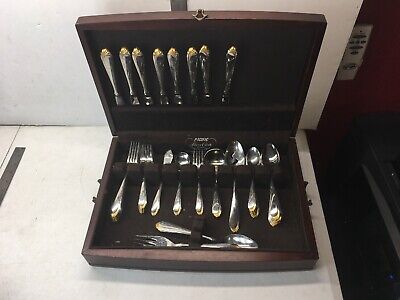
You are a GUI agent. You are given a task and a screenshot of the screen. Output one action in this format:
    pyautogui.click(x=<x>, y=<y>)
    Task: Click on the fork
    The width and height of the screenshot is (400, 300).
    Given the screenshot: What is the action you would take?
    pyautogui.click(x=155, y=238), pyautogui.click(x=194, y=156), pyautogui.click(x=145, y=155), pyautogui.click(x=132, y=155)